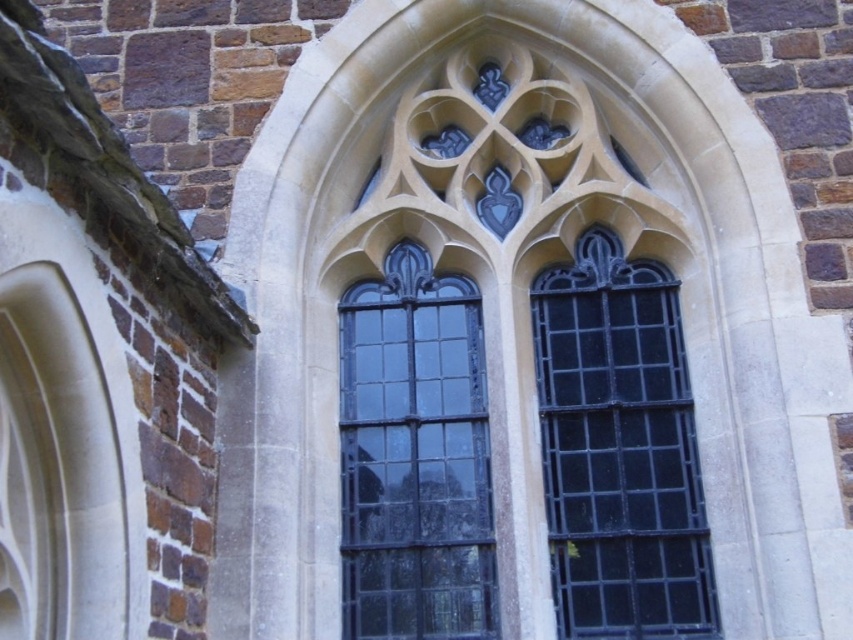
Between black metal grid at center and black glass window at center, which one has less height?

Standing shorter between the two is black glass window at center.

Is black metal grid at center in front of black glass window at center?

Yes.

Is point (578, 310) farther from viewer compared to point (473, 545)?

Yes, point (578, 310) is farther from viewer.

Find the location of a particular element. This screenshot has width=853, height=640. black metal grid at center is located at coordinates (619, 449).